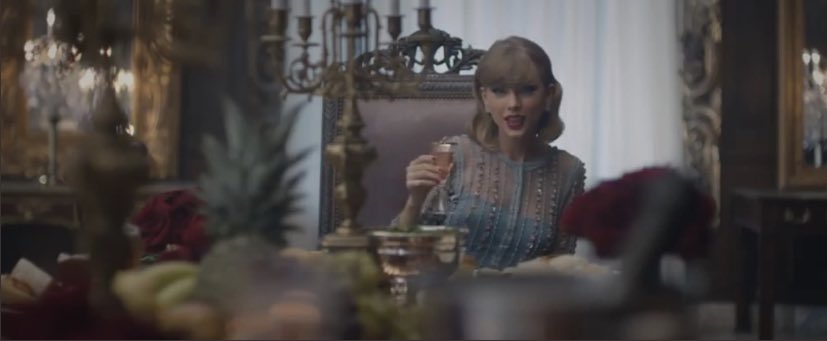
The width and height of the screenshot is (827, 341). Identify the location of chandelier. (433, 43).